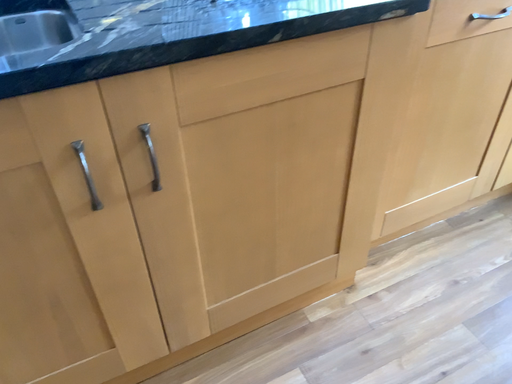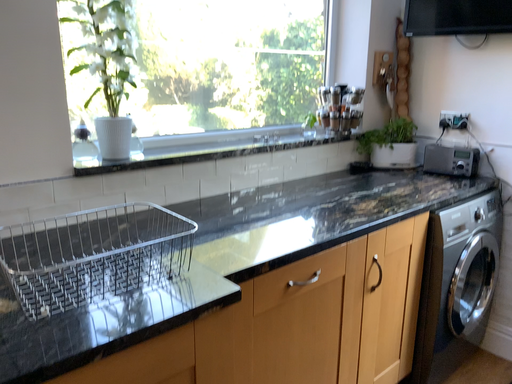
Question: How did the camera likely rotate when shooting the video?

Choices:
 (A) rotated left
 (B) rotated right

Answer: (B)